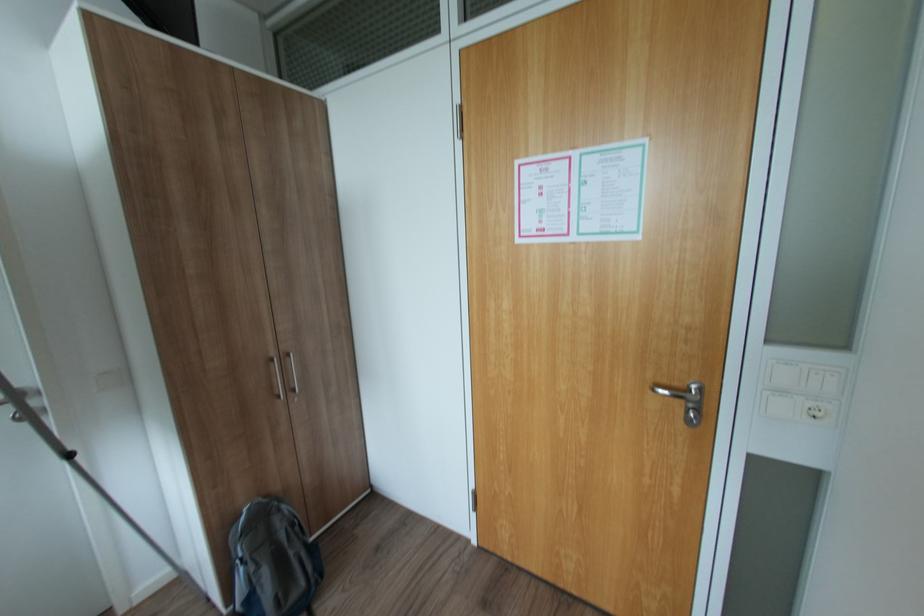
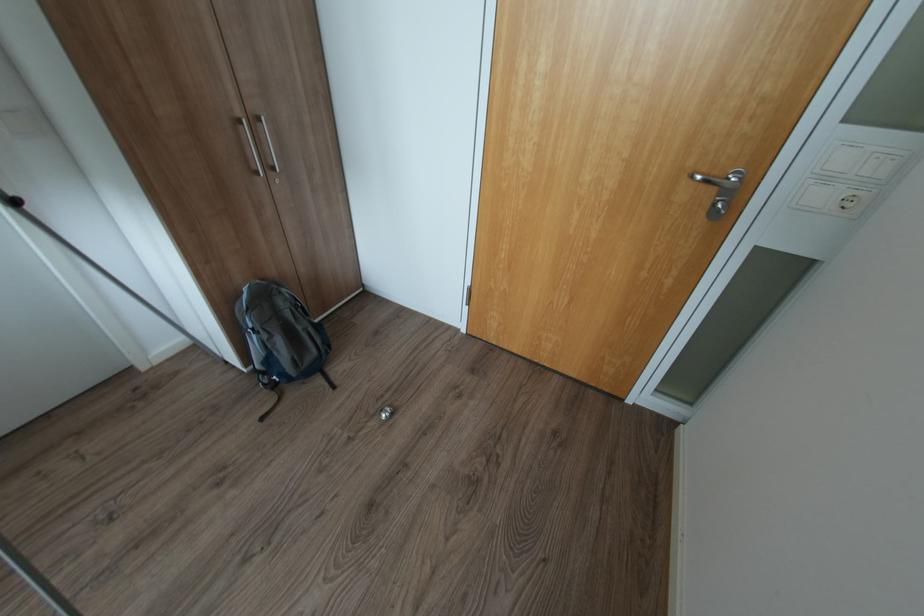
Question: How did the camera likely rotate?

Choices:
 (A) Left
 (B) Right
 (C) Up
 (D) Down

Answer: (D)